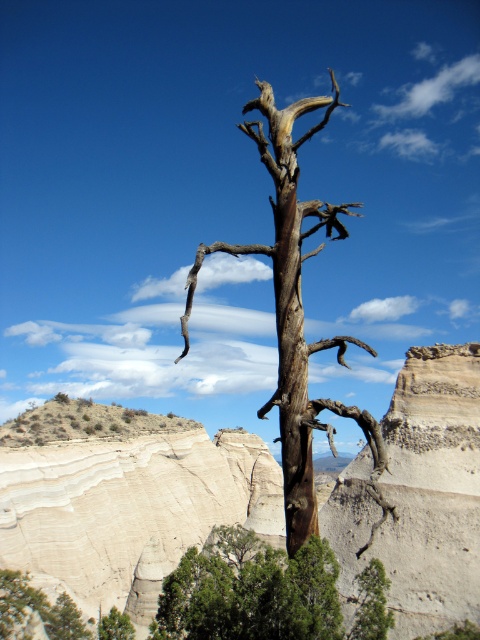
Does green leafy tree at lower center appear under green matte tree at lower left?

No.

Does green leafy tree at lower center have a greater width compared to green matte tree at lower left?

Yes, green leafy tree at lower center is wider than green matte tree at lower left.

Does point (180, 616) come farther from viewer compared to point (103, 632)?

No, it is in front of (103, 632).

At what (x,y) coordinates should I click in order to perform the action: click on green leafy tree at lower center. Please return your answer as a coordinate pair (x, y). The height and width of the screenshot is (640, 480). Looking at the image, I should click on (250, 592).

What do you see at coordinates (372, 604) in the screenshot? I see `green matte tree at lower right` at bounding box center [372, 604].

Who is higher up, green matte tree at lower right or green matte tree at lower left?

green matte tree at lower right is higher up.

Where is `green matte tree at lower right`? This screenshot has height=640, width=480. green matte tree at lower right is located at coordinates click(372, 604).

From the picture: Is brown rough bark tree at center smaller than green matte tree at lower left?

No, brown rough bark tree at center is not smaller than green matte tree at lower left.

Does brown rough bark tree at center appear under green matte tree at lower left?

No.

Does point (292, 477) come farther from viewer compared to point (124, 625)?

No.

The image size is (480, 640). Identify the location of brown rough bark tree at center. (296, 312).